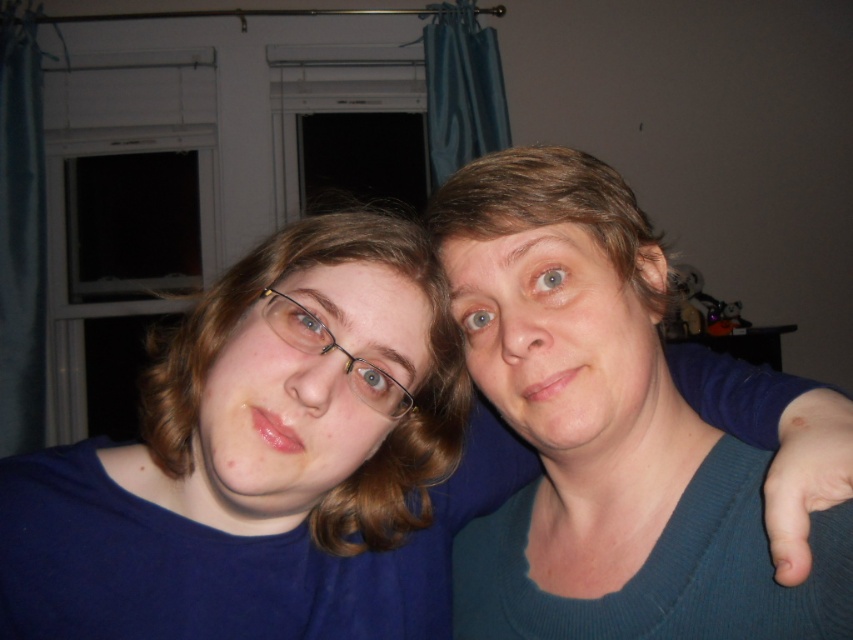
You are trying to decide which item of clothing to choose for an outfit. You have the matte blue sweater at center and the matte blue shirt at center in front of you. Based on their sizes, which one do you think would cover more area?

The matte blue sweater at center might be wider than the matte blue shirt at center, so the sweater would likely cover more area.

You are an interior designer analyzing the placement of objects in the image. The matte blue shirt at center is positioned at coordinates 0.533 on the x and 0.655 on the y axis. Can you determine if this placement aligns with the standard center of the room?

The standard center of the room would typically be at coordinates (426, 320). The matte blue shirt at center is located at 0.533 on the x and 0.655 on the y axis, which is slightly to the right and above the center point. Therefore, it is not perfectly centered but close to the center of the room.

You are trying to decide whether to place a teal sweater at center and matte plastic glasses at center on a small shelf. Based on their sizes, which one should you place first to ensure both fit?

The teal sweater at center is bigger than the matte plastic glasses at center, so you should place the teal sweater at center first to ensure both items fit on the shelf.